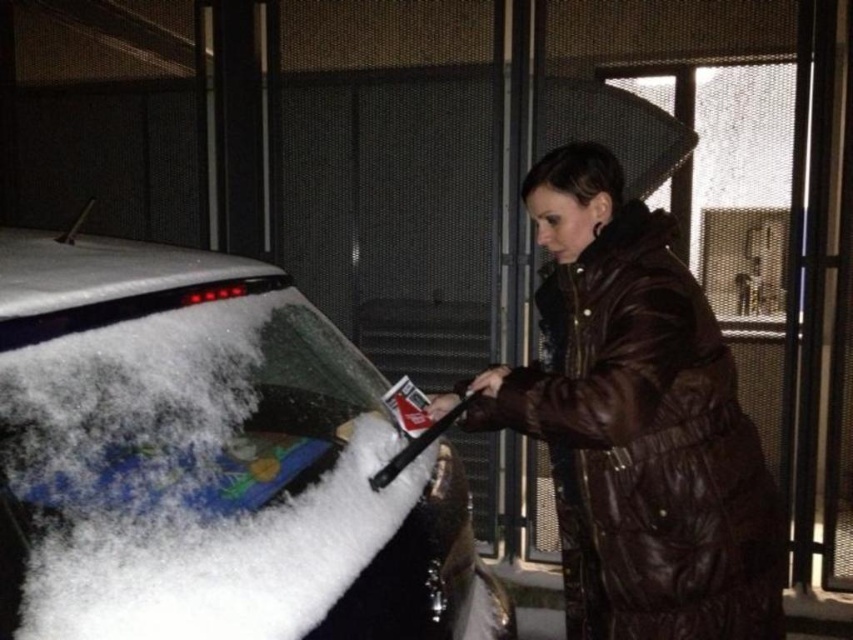
You are a delivery driver who needs to check the rearview mirror to navigate. The point at coordinates (210, 461) is where the snow is thickest on the windshield. Is the snow at this point located to the left or right side of the windshield?

The point at coordinates (210, 461) corresponds to snow covered glass at left, so the snow at this point is located on the left side of the windshield.

Based on the photo, you are standing in front of the car with the white roof and colorful windshield design. There are two points marked on the windshield, one at coordinates point (299, 625) and the other at point (613, 566). Which of these points is closer to you?

Point (299, 625) is closer to the camera than point (613, 566).